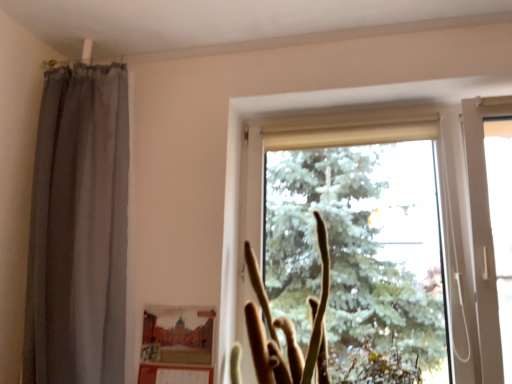
Question: Is transparent glass window at center surrounded by matte cardboard picture frame at lower center?

Choices:
 (A) yes
 (B) no

Answer: (B)

Question: Does matte cardboard picture frame at lower center have a larger size compared to transparent glass window at center?

Choices:
 (A) yes
 (B) no

Answer: (B)

Question: Is matte cardboard picture frame at lower center looking in the opposite direction of transparent glass window at center?

Choices:
 (A) no
 (B) yes

Answer: (A)

Question: Does matte cardboard picture frame at lower center have a greater width compared to transparent glass window at center?

Choices:
 (A) yes
 (B) no

Answer: (B)

Question: Considering the relative sizes of matte cardboard picture frame at lower center and transparent glass window at center in the image provided, is matte cardboard picture frame at lower center taller than transparent glass window at center?

Choices:
 (A) no
 (B) yes

Answer: (A)

Question: In terms of size, does matte cardboard picture frame at lower center appear bigger or smaller than transparent glass window at center?

Choices:
 (A) small
 (B) big

Answer: (A)

Question: From a real-world perspective, is matte cardboard picture frame at lower center physically located above or below transparent glass window at center?

Choices:
 (A) below
 (B) above

Answer: (A)

Question: From the image's perspective, relative to transparent glass window at center, is matte cardboard picture frame at lower center above or below?

Choices:
 (A) below
 (B) above

Answer: (A)

Question: Is matte cardboard picture frame at lower center taller or shorter than transparent glass window at center?

Choices:
 (A) tall
 (B) short

Answer: (B)

Question: Relative to transparent glass window at center, is brown fuzzy plant at center in front or behind?

Choices:
 (A) behind
 (B) front

Answer: (B)

Question: Considering the positions of point (263, 291) and point (373, 281), is point (263, 291) closer or farther from the camera than point (373, 281)?

Choices:
 (A) closer
 (B) farther

Answer: (A)

Question: Is brown fuzzy plant at center taller or shorter than transparent glass window at center?

Choices:
 (A) tall
 (B) short

Answer: (B)

Question: From a real-world perspective, is brown fuzzy plant at center positioned above or below transparent glass window at center?

Choices:
 (A) below
 (B) above

Answer: (A)

Question: Relative to brown fuzzy plant at center, is transparent glass window at center in front or behind?

Choices:
 (A) behind
 (B) front

Answer: (A)

Question: From a real-world perspective, relative to brown fuzzy plant at center, is transparent glass window at center vertically above or below?

Choices:
 (A) above
 (B) below

Answer: (A)